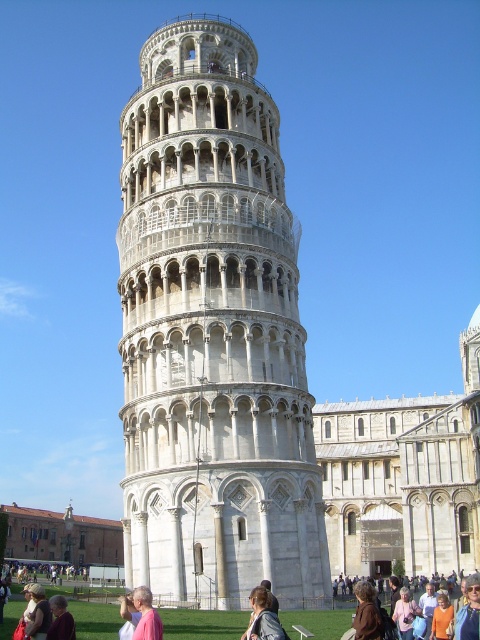
You are standing at the base of the Leaning Tower of Pisa and want to take a photo of both the point at coordinates point [223,236] and point [71,618]. Which point should you position closer to the front of your camera frame to ensure both are visible?

Since point [223,236] is behind point [71,618], you should position point [71,618] closer to the front of your camera frame to ensure both points are visible without one blocking the other.

You are a photographer planning to capture a wide shot of the white stone tower at center and the light brown hair at lower left. Based on their sizes, which object should you focus on to ensure both fit in the frame without cropping?

The white stone tower at center is wider than the light brown hair at lower left, so focusing on the white stone tower at center ensures both objects fit in the frame without cropping.